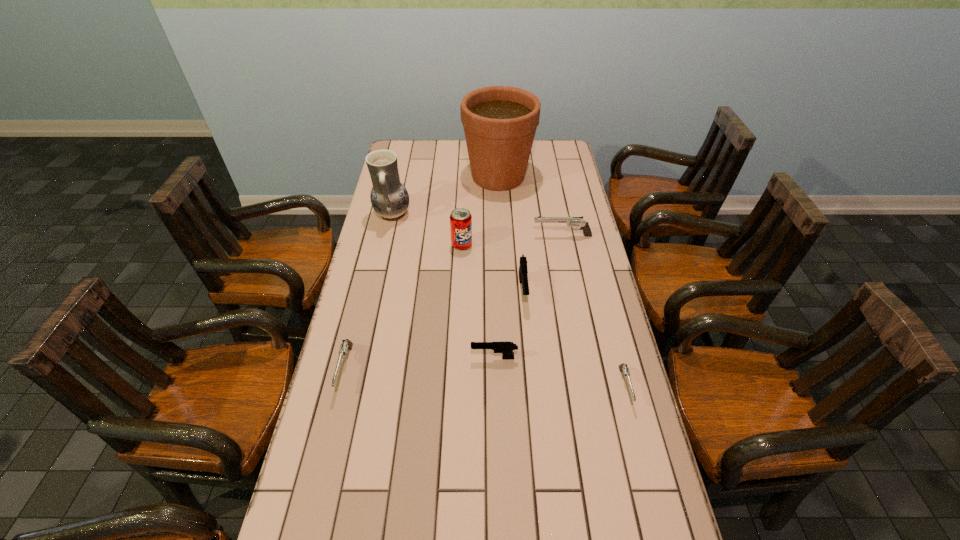
At what (x,y) coordinates should I click in order to perform the action: click on pistol that is at the left edge. Please return your answer as a coordinate pair (x, y). The image size is (960, 540). Looking at the image, I should click on (346, 345).

Where is `free region at the far edge`? free region at the far edge is located at coordinates (468, 161).

Locate an element on the screen. free region at the left edge is located at coordinates (394, 253).

Where is `vacant space at the right edge of the desktop`? vacant space at the right edge of the desktop is located at coordinates (560, 173).

In the image, there is a desktop. Where is `blank space at the far left corner`? The width and height of the screenshot is (960, 540). blank space at the far left corner is located at coordinates (425, 146).

I want to click on vacant region at the far right corner of the desktop, so coord(560,157).

In order to click on unoccupied position between the shortest pistol and the sixth shortest object in this screenshot , I will do `click(543, 316)`.

The image size is (960, 540). I want to click on free space between the fourth pistol from right to left and the pottery, so click(444, 286).

The image size is (960, 540). Identify the location of free point between the nearer black pistol and the second biggest silver pistol. click(x=420, y=363).

Find the location of a particular element. The height and width of the screenshot is (540, 960). free space between the leftmost silver pistol and the second farthest object is located at coordinates (369, 292).